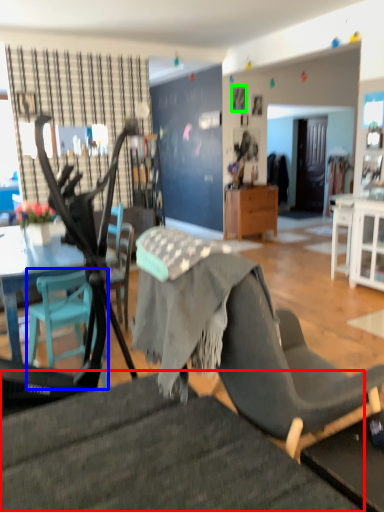
Question: Which object is the farthest from chair (highlighted by a red box)? Choose among these: chair (highlighted by a blue box) or picture frame (highlighted by a green box).

Choices:
 (A) chair
 (B) picture frame

Answer: (B)